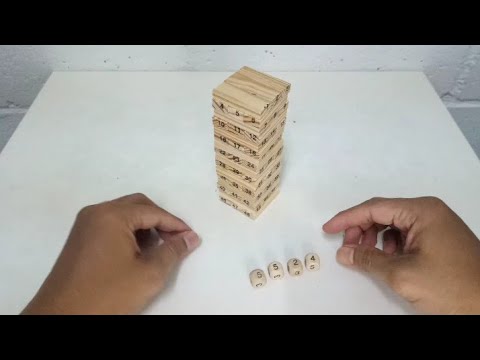
I want to click on white surface, so click(x=332, y=157), click(x=174, y=149).